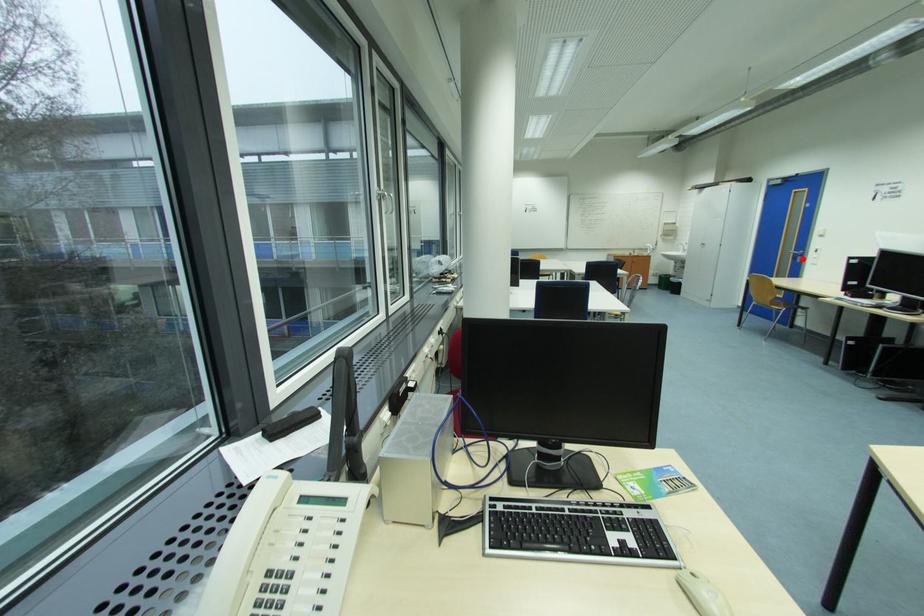
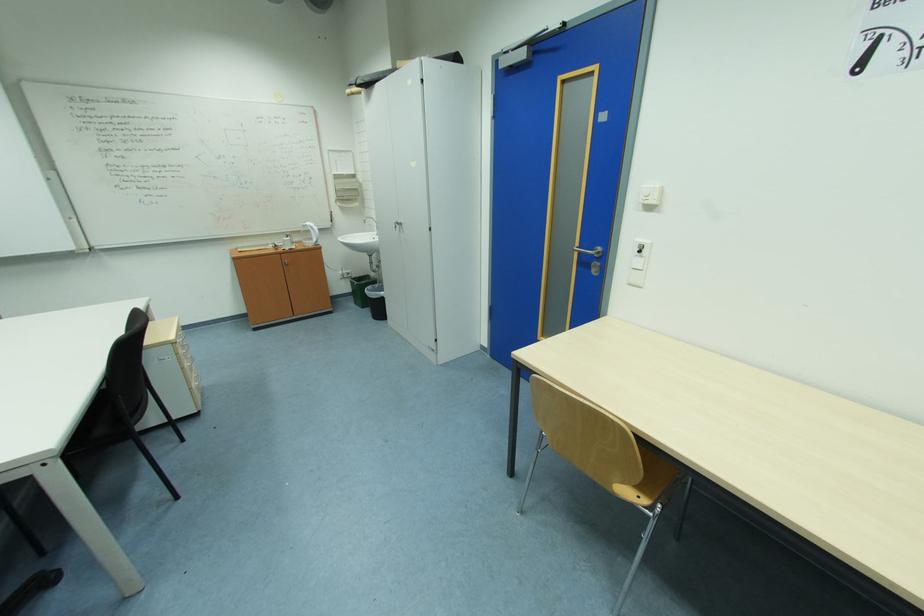
Question: I am providing you with two images of the same scene from different viewpoints. A red point is marked on the first image. At the location where the point appears in image 1, is it still visible in image 2?

Choices:
 (A) Yes
 (B) No

Answer: (A)